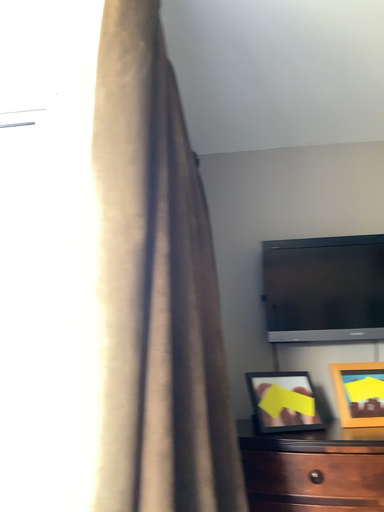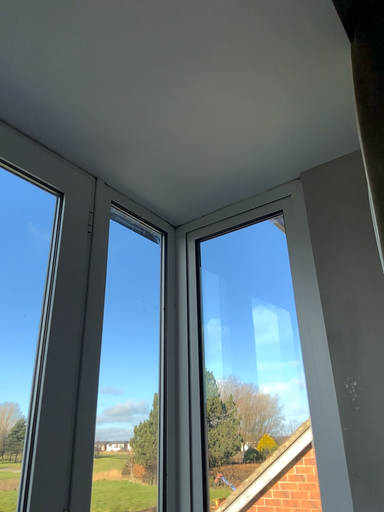
Question: How did the camera likely rotate when shooting the video?

Choices:
 (A) rotated right
 (B) rotated left

Answer: (B)